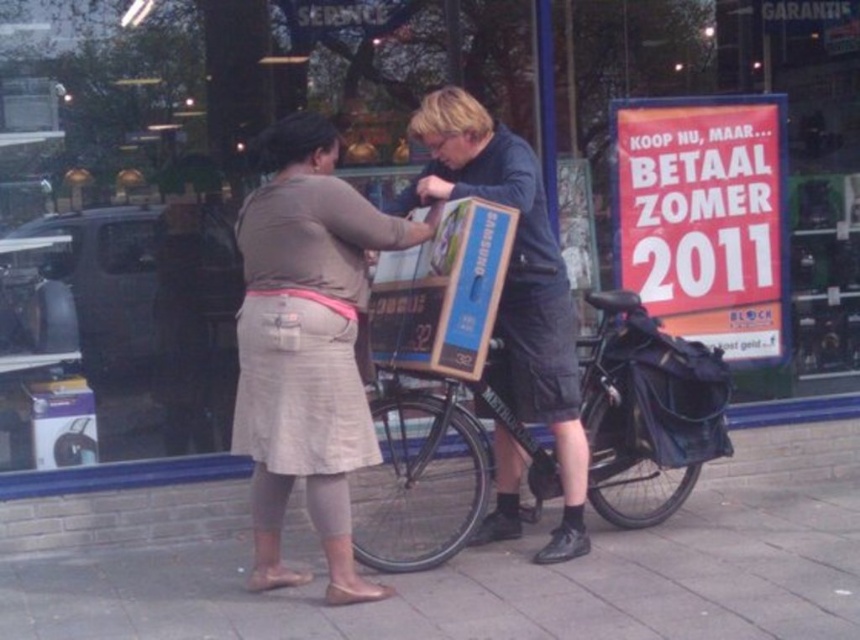
Question: Which point is closer to the camera taking this photo?

Choices:
 (A) (819, 500)
 (B) (358, 301)
 (C) (636, 356)
 (D) (550, 321)

Answer: (B)

Question: Which object appears farthest from the camera in this image?

Choices:
 (A) black matte bicycle at center
 (B) beige fabric skirt at center

Answer: (A)

Question: Does smooth concrete pavement at center lie in front of beige fabric skirt at center?

Choices:
 (A) no
 (B) yes

Answer: (B)

Question: Is smooth concrete pavement at center positioned behind black matte bicycle at center?

Choices:
 (A) yes
 (B) no

Answer: (B)

Question: From the image, what is the correct spatial relationship of smooth concrete pavement at center in relation to matte black bicycle at center?

Choices:
 (A) left
 (B) right

Answer: (B)

Question: Which object is farther from the camera taking this photo?

Choices:
 (A) beige fabric skirt at center
 (B) smooth concrete pavement at center

Answer: (A)